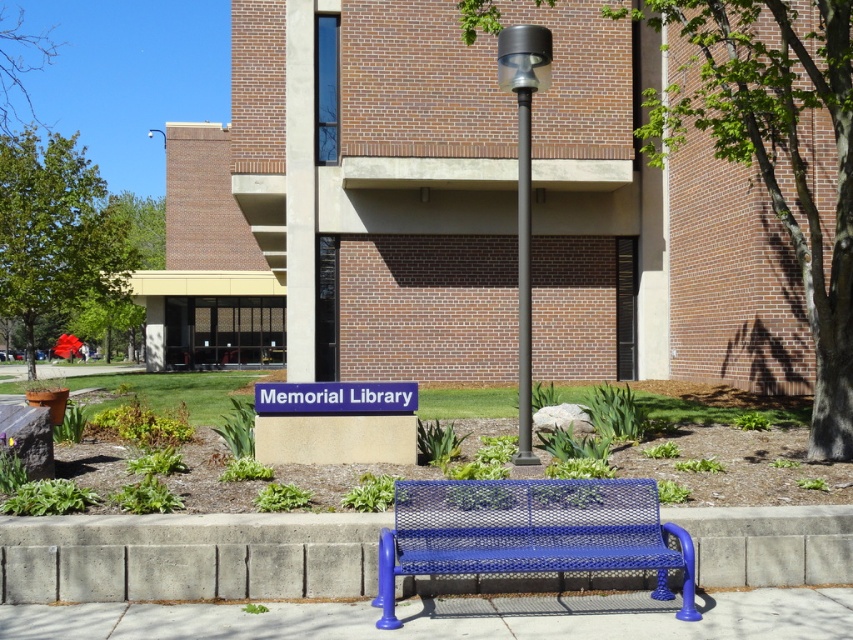
You are standing at the entrance of the Memorial Library and want to walk towards the dark gray metal pole at center. Which direction should you move relative to the smooth concrete pavement at lower center?

You should move towards the dark gray metal pole at center, which is behind the smooth concrete pavement at lower center according to the description.